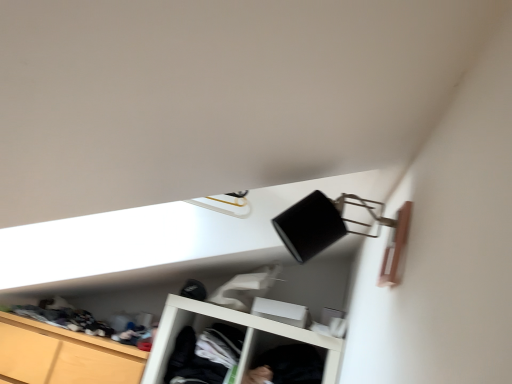
Question: Considering the relative sizes of black cotton shirt at lower center, the second clothing viewed from the left, and wooden cabinet at lower left in the image provided, is black cotton shirt at lower center, the second clothing viewed from the left, thinner than wooden cabinet at lower left?

Choices:
 (A) no
 (B) yes

Answer: (B)

Question: Is wooden cabinet at lower left completely or partially inside black cotton shirt at lower center, the first clothing when ordered from right to left?

Choices:
 (A) no
 (B) yes

Answer: (A)

Question: Is black cotton shirt at lower center, the second clothing viewed from the left, further to camera compared to wooden cabinet at lower left?

Choices:
 (A) no
 (B) yes

Answer: (A)

Question: Does black cotton shirt at lower center, the second clothing viewed from the left, have a smaller size compared to wooden cabinet at lower left?

Choices:
 (A) no
 (B) yes

Answer: (B)

Question: Is black cotton shirt at lower center, the second clothing viewed from the left, positioned beyond the bounds of wooden cabinet at lower left?

Choices:
 (A) no
 (B) yes

Answer: (B)

Question: Is black cotton shirt at lower center, the first clothing when ordered from right to left, oriented towards wooden cabinet at lower left?

Choices:
 (A) yes
 (B) no

Answer: (B)

Question: Is dark gray fabric at center, the first clothing when ordered from left to right, with black cotton shirt at lower center, the first clothing when ordered from right to left?

Choices:
 (A) yes
 (B) no

Answer: (B)

Question: Is dark gray fabric at center, the second clothing when ordered from right to left, far from black cotton shirt at lower center, the second clothing viewed from the left?

Choices:
 (A) no
 (B) yes

Answer: (A)

Question: Is dark gray fabric at center, the second clothing when ordered from right to left, not within black cotton shirt at lower center, the first clothing when ordered from right to left?

Choices:
 (A) no
 (B) yes

Answer: (B)

Question: From the image's perspective, is dark gray fabric at center, the second clothing when ordered from right to left, on black cotton shirt at lower center, the first clothing when ordered from right to left?

Choices:
 (A) yes
 (B) no

Answer: (A)

Question: Can you confirm if dark gray fabric at center, the second clothing when ordered from right to left, is smaller than black cotton shirt at lower center, the second clothing viewed from the left?

Choices:
 (A) yes
 (B) no

Answer: (B)

Question: Can you confirm if dark gray fabric at center, the second clothing when ordered from right to left, is thinner than black cotton shirt at lower center, the second clothing viewed from the left?

Choices:
 (A) yes
 (B) no

Answer: (B)

Question: Can you confirm if black cotton shirt at lower center, the second clothing viewed from the left, is bigger than dark gray fabric at center, the first clothing when ordered from left to right?

Choices:
 (A) no
 (B) yes

Answer: (A)